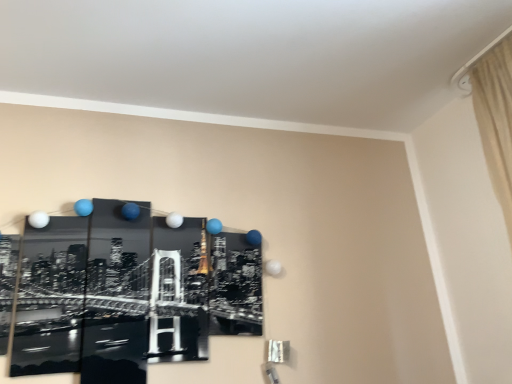
What are the coordinates of `black glossy cityscape art at upper left` in the screenshot? It's located at (127, 294).

The width and height of the screenshot is (512, 384). What do you see at coordinates (127, 294) in the screenshot?
I see `black glossy cityscape art at upper left` at bounding box center [127, 294].

Where is `black glossy cityscape art at upper left`? black glossy cityscape art at upper left is located at coordinates (127, 294).